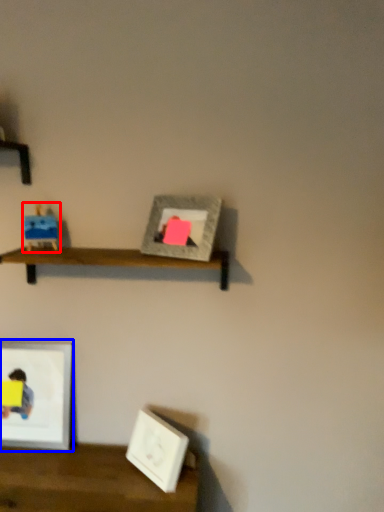
Question: Which object is further to the camera taking this photo, toy (highlighted by a red box) or picture frame (highlighted by a blue box)?

Choices:
 (A) toy
 (B) picture frame

Answer: (B)